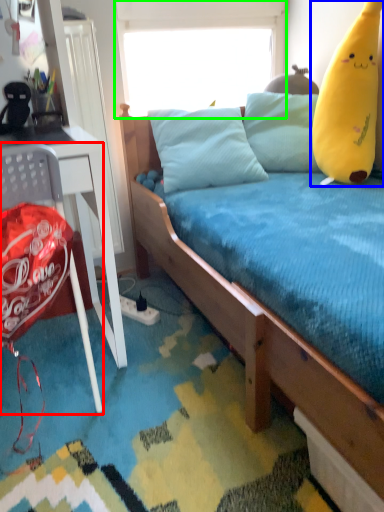
Question: Which object is positioned closest to chair (highlighted by a red box)? Select from toy (highlighted by a blue box) and window screen (highlighted by a green box).

Choices:
 (A) toy
 (B) window screen

Answer: (A)